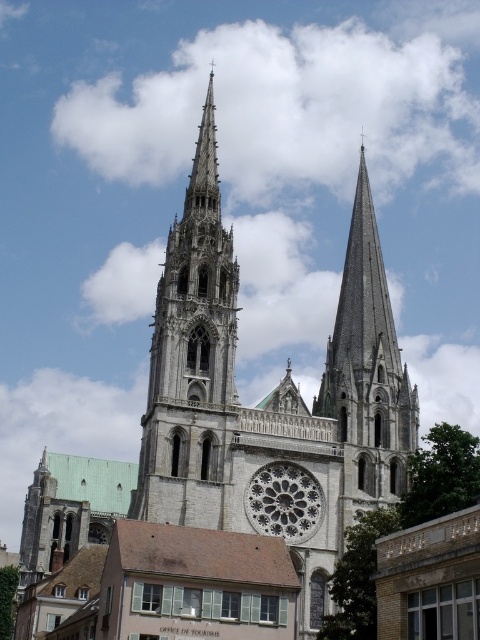
Measure the distance from gray stone spire at center to white stone rose window at center.

They are 65.68 feet apart.

Is point (373, 225) farther from camera compared to point (268, 508)?

Yes, it is behind point (268, 508).

Who is more distant from viewer, [376,401] or [286,497]?

The point [376,401] is behind.

What are the coordinates of `gray stone spire at center` in the screenshot? It's located at (367, 372).

How far apart are white fluffy cloud at upper center and white stone rose window at center?

A distance of 117.96 meters exists between white fluffy cloud at upper center and white stone rose window at center.

Does white fluffy cloud at upper center appear over white stone rose window at center?

Correct, white fluffy cloud at upper center is located above white stone rose window at center.

Where is `white fluffy cloud at upper center`? The image size is (480, 640). white fluffy cloud at upper center is located at coordinates (285, 109).

From the picture: Between stone gothic cathedral spire at center and gray stone spire at center, which one is positioned lower?

gray stone spire at center is lower down.

Between stone gothic cathedral spire at center and gray stone spire at center, which one has less height?

gray stone spire at center is shorter.

Is point (217, 333) farther from camera compared to point (342, 385)?

No, (217, 333) is in front of (342, 385).

Where is `stone gothic cathedral spire at center`? The width and height of the screenshot is (480, 640). stone gothic cathedral spire at center is located at coordinates (192, 358).